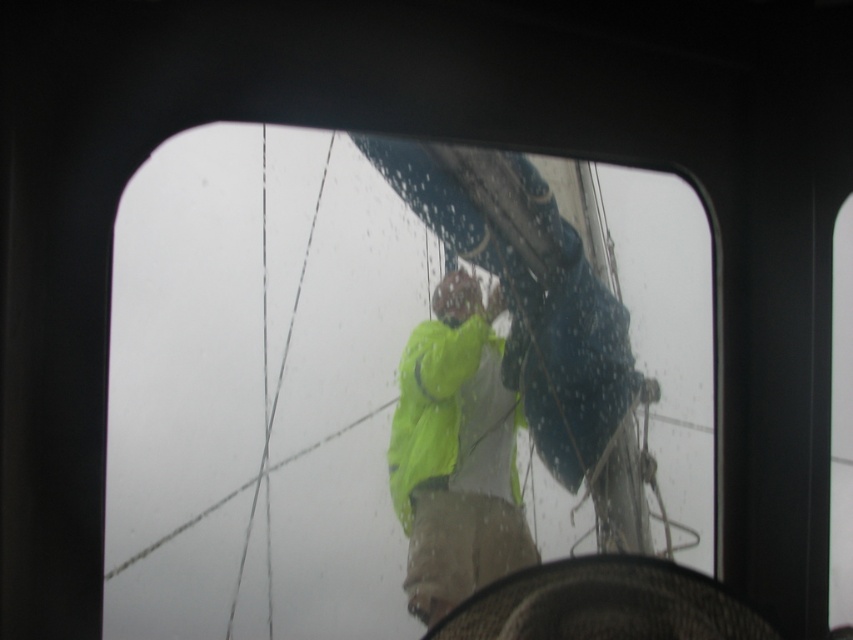
Question: Is transparent glass sailboat at center below neon yellow raincoat at center?

Choices:
 (A) yes
 (B) no

Answer: (B)

Question: Does transparent glass sailboat at center have a lesser width compared to neon yellow raincoat at center?

Choices:
 (A) yes
 (B) no

Answer: (B)

Question: Which object appears closest to the camera in this image?

Choices:
 (A) neon yellow raincoat at center
 (B) transparent glass sailboat at center

Answer: (B)

Question: Which of the following is the closest to the observer?

Choices:
 (A) (122, 472)
 (B) (473, 515)

Answer: (A)

Question: Is transparent glass sailboat at center thinner than neon yellow raincoat at center?

Choices:
 (A) yes
 (B) no

Answer: (B)